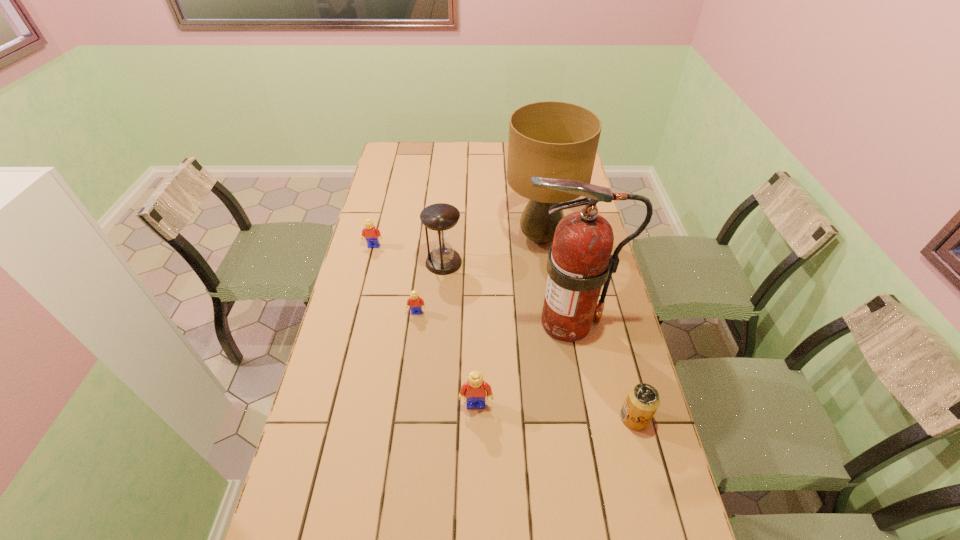
Locate an element on the screen. the second tallest Lego is located at coordinates (370, 232).

I want to click on the leftmost Lego, so click(x=370, y=232).

Locate an element on the screen. This screenshot has height=540, width=960. the shortest object is located at coordinates (415, 303).

Where is `the second Lego from left to right`? The image size is (960, 540). the second Lego from left to right is located at coordinates (415, 303).

I want to click on the rightmost Lego, so click(474, 390).

Where is `the tallest Lego`? The height and width of the screenshot is (540, 960). the tallest Lego is located at coordinates (474, 390).

Locate an element on the screen. fire extinguisher is located at coordinates (579, 263).

This screenshot has height=540, width=960. In order to click on lampshade in this screenshot , I will do `click(550, 139)`.

This screenshot has width=960, height=540. I want to click on the fifth shortest object, so (440, 218).

Find the location of a particular element. This screenshot has height=540, width=960. beer can is located at coordinates (642, 401).